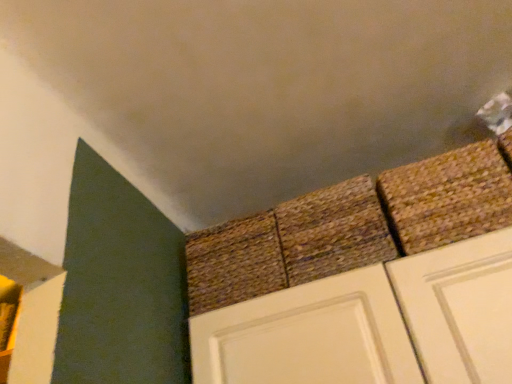
Question: Choose the correct answer: Is brown woven rug at upper right, the first brick positioned from the right, inside brown woven mat at center, marked as the third brick in a right-to-left arrangement, or outside it?

Choices:
 (A) outside
 (B) inside

Answer: (A)

Question: From the image's perspective, relative to brown woven mat at center, which ranks as the 1th brick in left-to-right order, is brown woven rug at upper right, the first brick positioned from the right, above or below?

Choices:
 (A) below
 (B) above

Answer: (B)

Question: Which of these objects is positioned closest to the rustic woven mat at center, placed as the second brick when sorted from right to left?

Choices:
 (A) brown woven mat at center, which ranks as the 1th brick in left-to-right order
 (B) brown woven rug at upper right, placed as the third brick when sorted from left to right

Answer: (A)

Question: Which is nearer to the rustic woven mat at center, placed as the second brick when sorted from right to left?

Choices:
 (A) brown woven mat at center, marked as the third brick in a right-to-left arrangement
 (B) brown woven rug at upper right, placed as the third brick when sorted from left to right

Answer: (A)